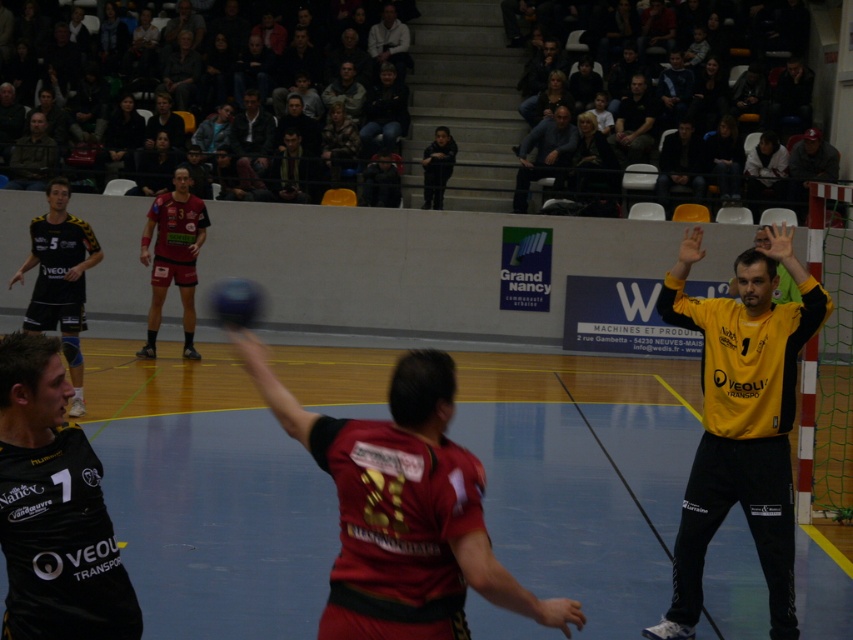
You are a photographer standing at the edge of the arena. You want to take a photo that includes both the dark blue jeans at center and the light gray sweater at upper center. Which object should you adjust your camera angle to focus on first to ensure both are in frame?

The dark blue jeans at center is wider than the light gray sweater at upper center, so you should focus on the dark blue jeans at center first to ensure both fit within the camera frame.

You are a sports analyst reviewing the handball match. You notice the black matte jersey at left and the red jersey with the number 3 on the back in the foreground. Based on their positions, which player is closer to the goalpost?

The black matte jersey at left is located at point (53, 509), which places it closer to the goalpost than the red jersey with the number 3 on the back in the foreground.

You are a spectator at the handball match. You notice the black matte jersey at left and the dark blue jeans at center. Based on their positions, which one is closer to the ground?

The black matte jersey at left is located below dark blue jeans at center, so it is closer to the ground.